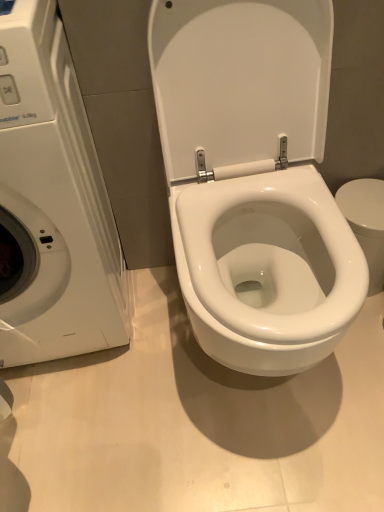
Question: Is white glossy toilet at center bigger or smaller than white glossy washing machine at left?

Choices:
 (A) small
 (B) big

Answer: (A)

Question: Is white glossy toilet at center spatially inside white glossy washing machine at left, or outside of it?

Choices:
 (A) outside
 (B) inside

Answer: (A)

Question: Is white glossy toilet at center wider or thinner than white glossy washing machine at left?

Choices:
 (A) thin
 (B) wide

Answer: (A)

Question: In the image, is white glossy washing machine at left on the left side or the right side of white glossy toilet at center?

Choices:
 (A) left
 (B) right

Answer: (A)

Question: From the image's perspective, is white glossy washing machine at left positioned above or below white glossy toilet at center?

Choices:
 (A) above
 (B) below

Answer: (B)

Question: In the image, is white glossy washing machine at left positioned in front of or behind white glossy toilet at center?

Choices:
 (A) front
 (B) behind

Answer: (A)

Question: From a real-world perspective, is white glossy washing machine at left physically located above or below white glossy toilet at center?

Choices:
 (A) below
 (B) above

Answer: (A)